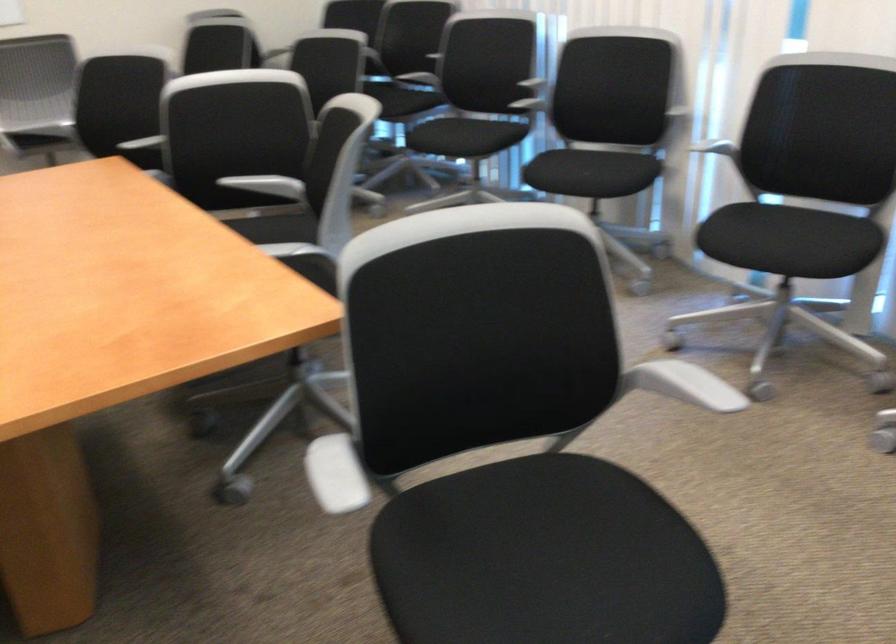
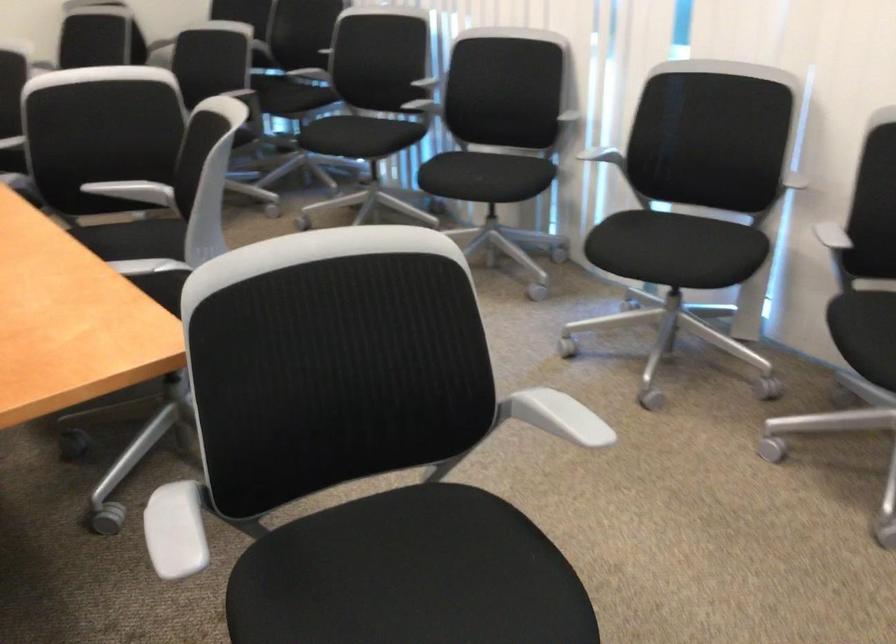
The images are taken continuously from a first-person perspective. In which direction are you moving?

The cameraman moved toward right, forward.